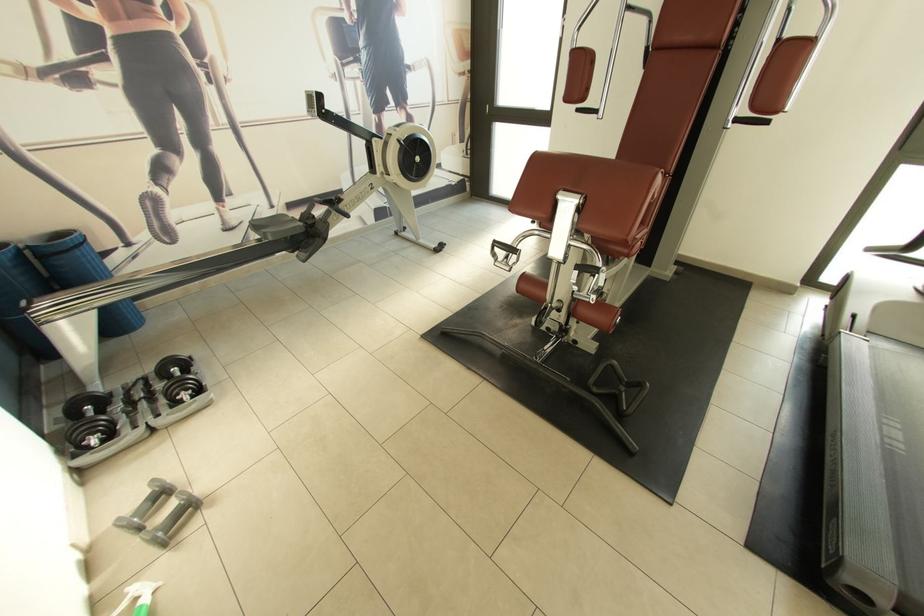
What do you see at coordinates (275, 227) in the screenshot?
I see `the rowing machine sitting surface` at bounding box center [275, 227].